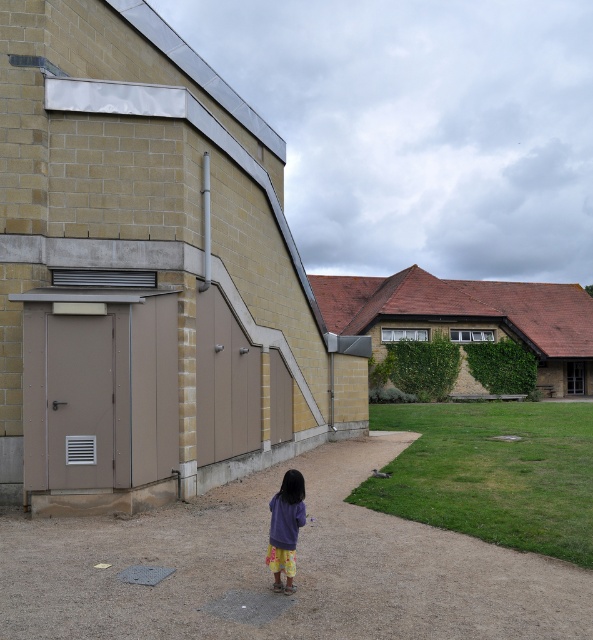
Is dirt path at lower center to the right of purple fabric at center from the viewer's perspective?

Incorrect, dirt path at lower center is not on the right side of purple fabric at center.

Between point (582, 625) and point (275, 524), which one is positioned behind?

The point (275, 524) is more distant.

Locate an element on the screen. This screenshot has height=640, width=593. dirt path at lower center is located at coordinates (296, 566).